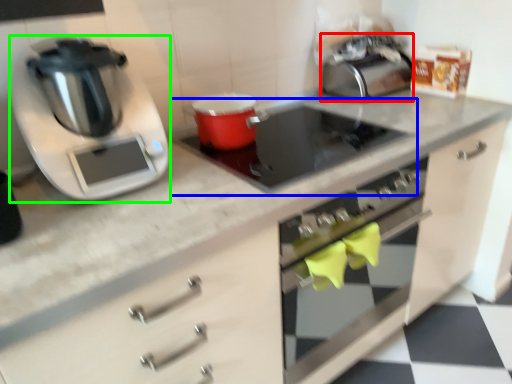
Question: Which object is the farthest from toaster (highlighted by a red box)? Choose among these: gas stove (highlighted by a blue box) or kitchen appliance (highlighted by a green box).

Choices:
 (A) gas stove
 (B) kitchen appliance

Answer: (B)